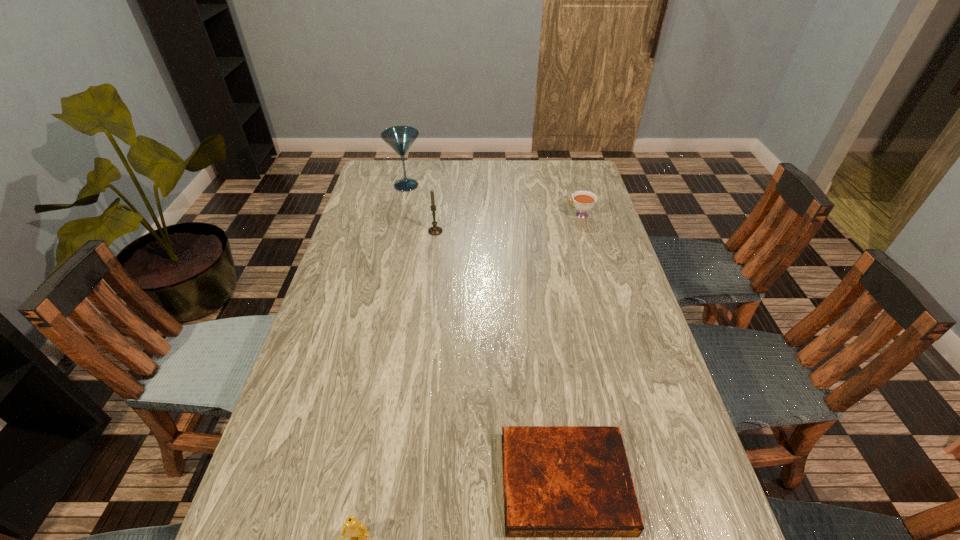
Where is `object that is the fourth closest to the fourth nearest object`? object that is the fourth closest to the fourth nearest object is located at coordinates (354, 529).

Point out which object is positioned as the second nearest to the Lego. Please provide its 2D coordinates. Your answer should be formatted as a tuple, i.e. [(x, y)], where the tuple contains the x and y coordinates of a point satisfying the conditions above.

[(435, 230)]

Where is `free space in the image that satisfies the following two spatial constraints: 1. on the side of the fourth nearest object with the handle; 2. on the spine side of the second object from right to left`? The image size is (960, 540). free space in the image that satisfies the following two spatial constraints: 1. on the side of the fourth nearest object with the handle; 2. on the spine side of the second object from right to left is located at coordinates (x=657, y=482).

Where is `free space that satisfies the following two spatial constraints: 1. on the front side of the third object from right to left; 2. on the left side of the martini`? The height and width of the screenshot is (540, 960). free space that satisfies the following two spatial constraints: 1. on the front side of the third object from right to left; 2. on the left side of the martini is located at coordinates (396, 231).